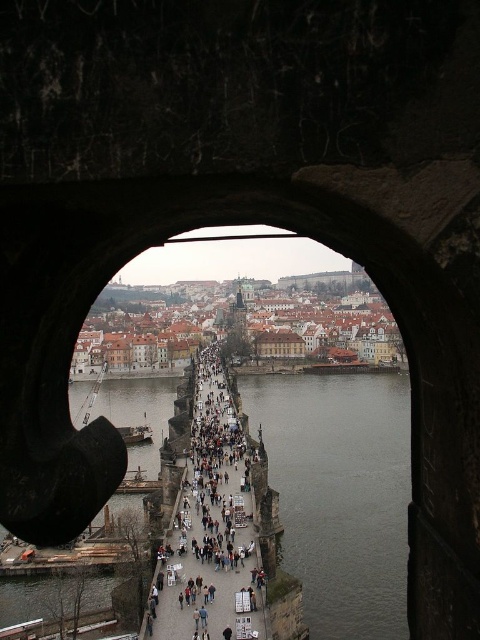
Question: Among these objects, which one is farthest from the camera?

Choices:
 (A) light brown wooden bridge at center
 (B) dark gray water at center

Answer: (B)

Question: In this image, where is dark gray water at center located relative to light brown wooden bridge at center?

Choices:
 (A) above
 (B) below

Answer: (B)

Question: Is dark gray water at center to the left of light brown wooden bridge at center from the viewer's perspective?

Choices:
 (A) no
 (B) yes

Answer: (A)

Question: Can you confirm if dark gray water at center is bigger than light brown wooden bridge at center?

Choices:
 (A) yes
 (B) no

Answer: (A)